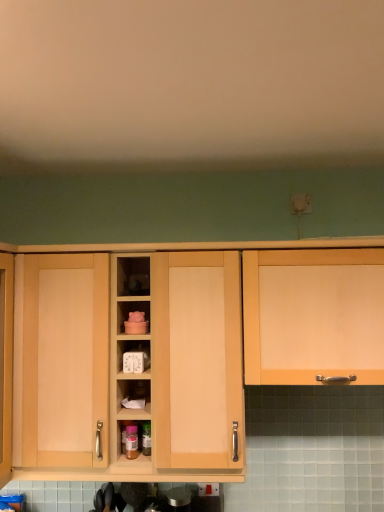
Question: Is matte wood cabinet at right, positioned as the first cabinetry in right-to-left order, closer to camera compared to white plastic timer at center?

Choices:
 (A) yes
 (B) no

Answer: (A)

Question: Is matte wood cabinet at right, placed as the 2th cabinetry when sorted from left to right, smaller than white plastic timer at center?

Choices:
 (A) yes
 (B) no

Answer: (B)

Question: Is white plastic timer at center surrounded by matte wood cabinet at right, positioned as the first cabinetry in right-to-left order?

Choices:
 (A) no
 (B) yes

Answer: (A)

Question: Can you confirm if matte wood cabinet at right, placed as the 2th cabinetry when sorted from left to right, is shorter than white plastic timer at center?

Choices:
 (A) no
 (B) yes

Answer: (A)

Question: Considering the relative positions of matte wood cabinet at right, placed as the 2th cabinetry when sorted from left to right, and white plastic timer at center in the image provided, is matte wood cabinet at right, placed as the 2th cabinetry when sorted from left to right, to the right of white plastic timer at center from the viewer's perspective?

Choices:
 (A) yes
 (B) no

Answer: (A)

Question: Based on their positions, is light wood cabinet at center, which is counted as the second cabinetry, starting from the right, located to the left or right of white plastic timer at center?

Choices:
 (A) left
 (B) right

Answer: (A)

Question: Is light wood cabinet at center, which is counted as the second cabinetry, starting from the right, bigger or smaller than white plastic timer at center?

Choices:
 (A) big
 (B) small

Answer: (A)

Question: Would you say light wood cabinet at center, which is counted as the second cabinetry, starting from the right, is inside or outside white plastic timer at center?

Choices:
 (A) inside
 (B) outside

Answer: (B)

Question: From their relative heights in the image, would you say light wood cabinet at center, which is counted as the second cabinetry, starting from the right, is taller or shorter than white plastic timer at center?

Choices:
 (A) tall
 (B) short

Answer: (A)

Question: Considering the positions of matte wood cabinet at right, positioned as the first cabinetry in right-to-left order, and light wood cabinet at center, which is the first cabinetry from left to right, in the image, is matte wood cabinet at right, positioned as the first cabinetry in right-to-left order, taller or shorter than light wood cabinet at center, which is the first cabinetry from left to right,?

Choices:
 (A) tall
 (B) short

Answer: (B)

Question: From a real-world perspective, is matte wood cabinet at right, placed as the 2th cabinetry when sorted from left to right, physically located above or below light wood cabinet at center, which is counted as the second cabinetry, starting from the right?

Choices:
 (A) below
 (B) above

Answer: (B)

Question: In the image, is matte wood cabinet at right, placed as the 2th cabinetry when sorted from left to right, positioned in front of or behind light wood cabinet at center, which is counted as the second cabinetry, starting from the right?

Choices:
 (A) front
 (B) behind

Answer: (A)

Question: Does point (253, 294) appear closer or farther from the camera than point (13, 250)?

Choices:
 (A) closer
 (B) farther

Answer: (A)

Question: Considering the positions of light wood cabinet at center, which is counted as the second cabinetry, starting from the right, and matte wood cabinet at right, placed as the 2th cabinetry when sorted from left to right, in the image, is light wood cabinet at center, which is counted as the second cabinetry, starting from the right, wider or thinner than matte wood cabinet at right, placed as the 2th cabinetry when sorted from left to right,?

Choices:
 (A) thin
 (B) wide

Answer: (B)

Question: Is point (372, 240) positioned closer to the camera than point (261, 252)?

Choices:
 (A) farther
 (B) closer

Answer: (A)